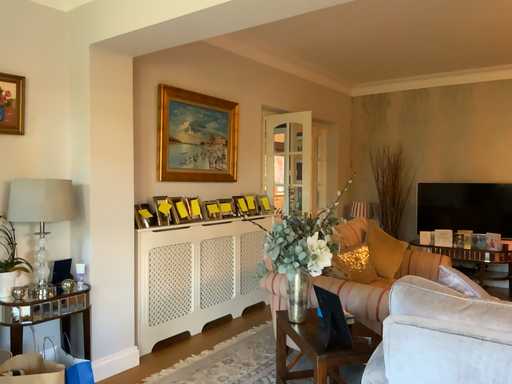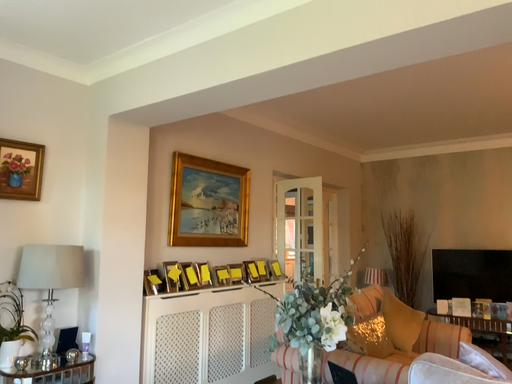
Question: How did the camera likely rotate when shooting the video?

Choices:
 (A) rotated upward
 (B) rotated downward

Answer: (A)